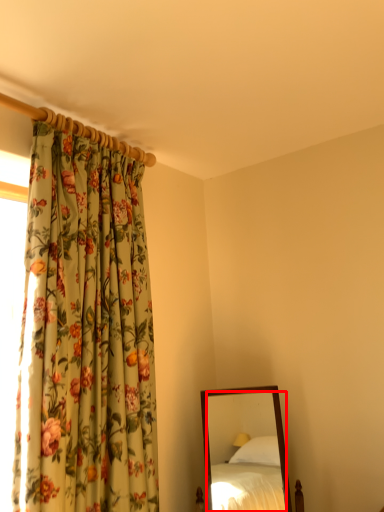
Question: Observing the image, what is the correct spatial positioning of mirror (annotated by the red box) in reference to curtain?

Choices:
 (A) right
 (B) left

Answer: (A)